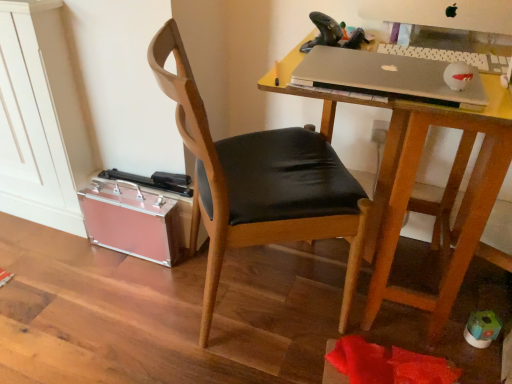
Question: Can you confirm if silver metallic keyboard at upper right is smaller than wooden chair at center?

Choices:
 (A) yes
 (B) no

Answer: (A)

Question: Can wooden chair at center be found inside silver metallic keyboard at upper right?

Choices:
 (A) no
 (B) yes

Answer: (A)

Question: Would you consider silver metallic keyboard at upper right to be distant from wooden chair at center?

Choices:
 (A) no
 (B) yes

Answer: (A)

Question: Is the position of silver metallic keyboard at upper right less distant than that of wooden chair at center?

Choices:
 (A) no
 (B) yes

Answer: (A)

Question: Considering the relative sizes of silver metallic keyboard at upper right and wooden chair at center in the image provided, is silver metallic keyboard at upper right taller than wooden chair at center?

Choices:
 (A) no
 (B) yes

Answer: (A)

Question: Does silver metallic keyboard at upper right have a lesser width compared to wooden chair at center?

Choices:
 (A) no
 (B) yes

Answer: (B)

Question: Would you say silver metallic keyboard at upper right is part of silver metallic laptop at upper right's contents?

Choices:
 (A) no
 (B) yes

Answer: (A)

Question: Does silver metallic laptop at upper right have a greater height compared to silver metallic keyboard at upper right?

Choices:
 (A) no
 (B) yes

Answer: (B)

Question: Is silver metallic laptop at upper right facing towards silver metallic keyboard at upper right?

Choices:
 (A) yes
 (B) no

Answer: (B)

Question: Is silver metallic laptop at upper right completely or partially outside of silver metallic keyboard at upper right?

Choices:
 (A) no
 (B) yes

Answer: (B)

Question: From a real-world perspective, is silver metallic laptop at upper right below silver metallic keyboard at upper right?

Choices:
 (A) no
 (B) yes

Answer: (A)

Question: Is silver metallic laptop at upper right bigger than silver metallic keyboard at upper right?

Choices:
 (A) yes
 (B) no

Answer: (A)

Question: Is silver metallic laptop at upper right outside wooden chair at center?

Choices:
 (A) yes
 (B) no

Answer: (B)